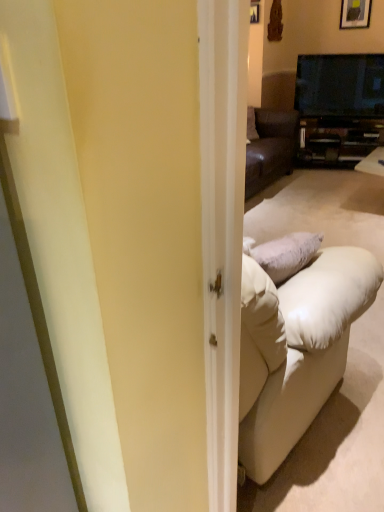
Question: From a real-world perspective, is black glossy tv at upper right on matte black cabinet at center?

Choices:
 (A) no
 (B) yes

Answer: (B)

Question: From a real-world perspective, does black glossy tv at upper right sit lower than matte black cabinet at center?

Choices:
 (A) yes
 (B) no

Answer: (B)

Question: Is black glossy tv at upper right behind matte black cabinet at center?

Choices:
 (A) no
 (B) yes

Answer: (A)

Question: Would you say black glossy tv at upper right is outside matte black cabinet at center?

Choices:
 (A) no
 (B) yes

Answer: (B)

Question: Is black glossy tv at upper right surrounding matte black cabinet at center?

Choices:
 (A) no
 (B) yes

Answer: (A)

Question: From a real-world perspective, relative to black glossy tv at upper right, is wooden framed picture at upper right vertically above or below?

Choices:
 (A) below
 (B) above

Answer: (B)

Question: Considering the positions of point (360, 4) and point (349, 74), is point (360, 4) closer or farther from the camera than point (349, 74)?

Choices:
 (A) farther
 (B) closer

Answer: (B)

Question: In the image, is wooden framed picture at upper right positioned in front of or behind black glossy tv at upper right?

Choices:
 (A) front
 (B) behind

Answer: (B)

Question: Is wooden framed picture at upper right inside the boundaries of black glossy tv at upper right, or outside?

Choices:
 (A) outside
 (B) inside

Answer: (A)

Question: Based on their positions, is matte black cabinet at center located to the left or right of black glossy tv at upper right?

Choices:
 (A) left
 (B) right

Answer: (B)

Question: In terms of height, does matte black cabinet at center look taller or shorter compared to black glossy tv at upper right?

Choices:
 (A) short
 (B) tall

Answer: (A)

Question: From the image's perspective, is matte black cabinet at center positioned above or below black glossy tv at upper right?

Choices:
 (A) below
 (B) above

Answer: (A)

Question: Is matte black cabinet at center in front of or behind black glossy tv at upper right in the image?

Choices:
 (A) behind
 (B) front

Answer: (A)

Question: Looking at the image, does black glossy tv at upper right seem bigger or smaller compared to wooden framed picture at upper right?

Choices:
 (A) big
 (B) small

Answer: (A)

Question: From a real-world perspective, is black glossy tv at upper right above or below wooden framed picture at upper right?

Choices:
 (A) above
 (B) below

Answer: (B)